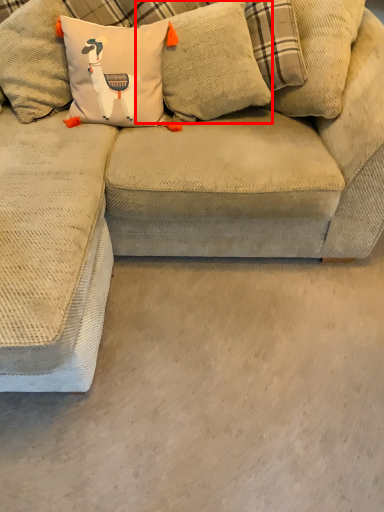
Question: From the image's perspective, considering the relative positions of pillow (annotated by the red box) and concrete in the image provided, where is pillow (annotated by the red box) located with respect to the staircase?

Choices:
 (A) above
 (B) below

Answer: (B)